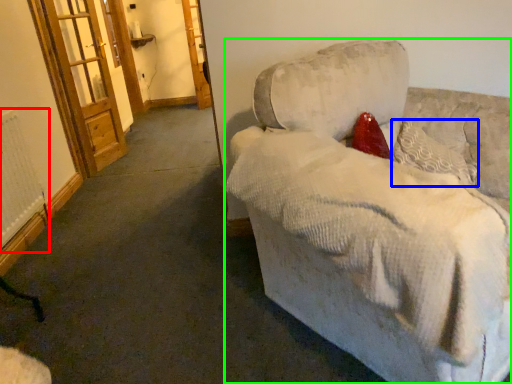
Question: Which is nearer to the radiator (highlighted by a red box)? pillow (highlighted by a blue box) or studio couch (highlighted by a green box).

Choices:
 (A) pillow
 (B) studio couch

Answer: (B)